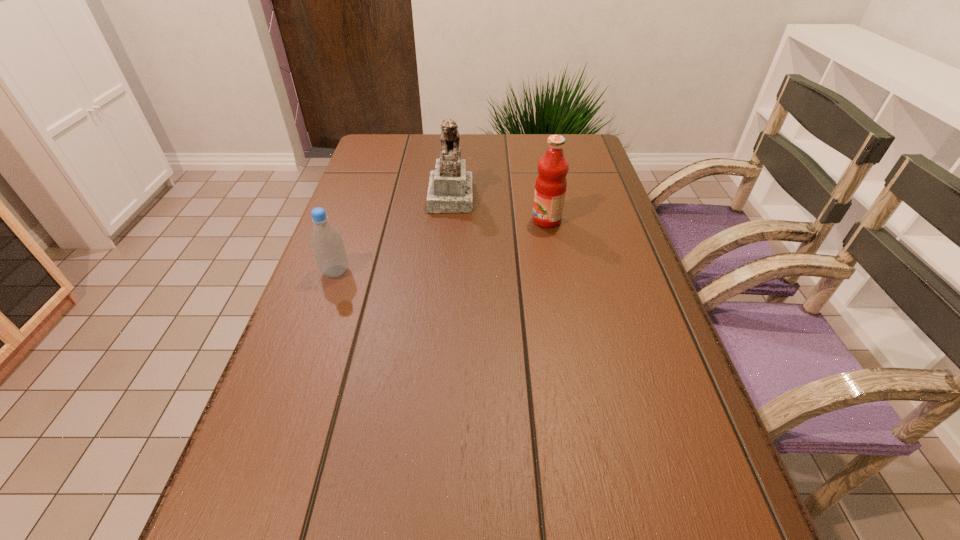
In order to click on free space between the nearest object and the fruit juice in this screenshot , I will do 441,246.

Identify the location of vacant area that lies between the second object from left to right and the nearest object. (393, 233).

I want to click on unoccupied area between the rightmost object and the second object from left to right, so click(x=498, y=208).

Identify which object is located as the nearest to the fruit juice. Please provide its 2D coordinates. Your answer should be formatted as a tuple, i.e. [(x, y)], where the tuple contains the x and y coordinates of a point satisfying the conditions above.

[(450, 186)]

Where is `the second closest object to the rightmost object`? This screenshot has width=960, height=540. the second closest object to the rightmost object is located at coordinates (327, 245).